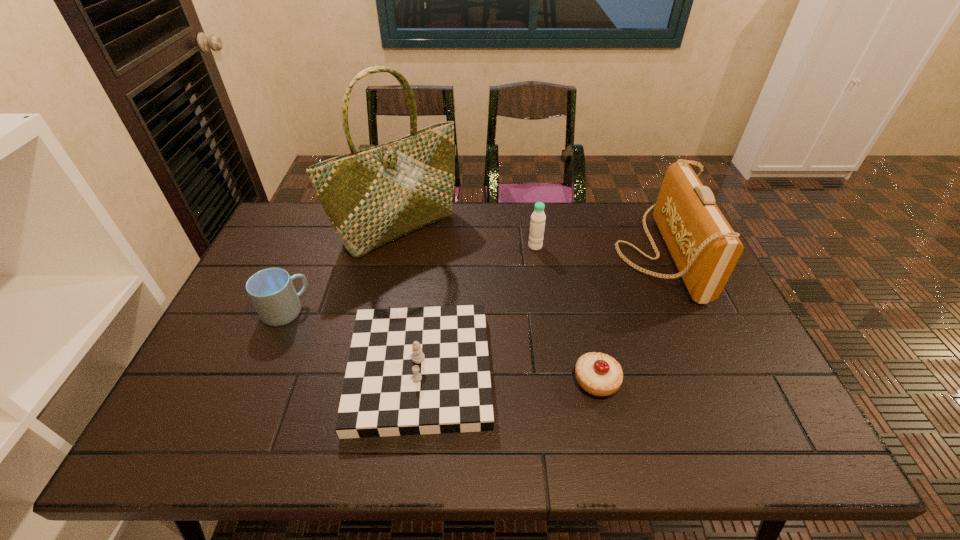
You are a GUI agent. You are given a task and a screenshot of the screen. Output one action in this format:
    pyautogui.click(x=<x>, y=<y>)
    Task: Click on the vacant region that satisfies the following two spatial constraints: 1. on the front side of the shortest object; 2. on the left side of the third object from right to left
    The image size is (960, 540).
    Given the screenshot: What is the action you would take?
    pyautogui.click(x=554, y=381)

At what (x,y) coordinates should I click in order to perform the action: click on free space in the image that satisfies the following two spatial constraints: 1. on the decorative side of the fifth shortest object; 2. on the front side of the pastry. Please return your answer as a coordinate pair (x, y). The image size is (960, 540). Looking at the image, I should click on (715, 381).